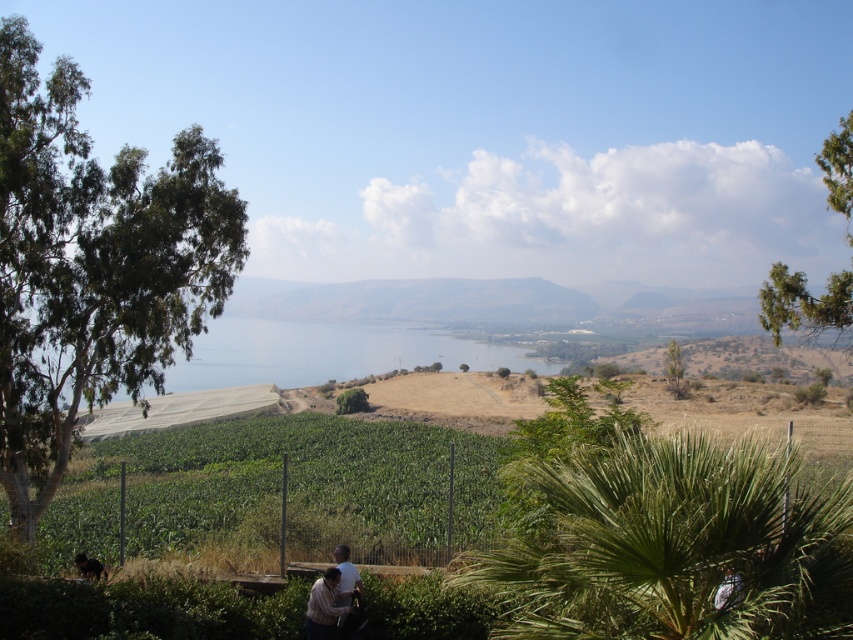
Question: Can you confirm if green leafy palm at center is smaller than green leafy tree at center?

Choices:
 (A) no
 (B) yes

Answer: (B)

Question: Estimate the real-world distances between objects in this image. Which object is closer to the green leafy tree at left?

Choices:
 (A) green leafy tree at upper right
 (B) green leafy palm at center
 (C) green leafy tree at center-right

Answer: (B)

Question: Which point is farther from the camera taking this photo?

Choices:
 (A) (3, 188)
 (B) (322, 612)
 (C) (845, 116)

Answer: (C)

Question: Which object is closer to the camera taking this photo?

Choices:
 (A) green leafy palm at center
 (B) dark brown leather jacket at lower center
 (C) green leafy tree at left

Answer: (A)

Question: Is green leafy tree at center-right smaller than green leafy tree at center?

Choices:
 (A) no
 (B) yes

Answer: (A)

Question: Does green leafy tree at upper right appear on the right side of dark brown leather jacket at lower center?

Choices:
 (A) yes
 (B) no

Answer: (A)